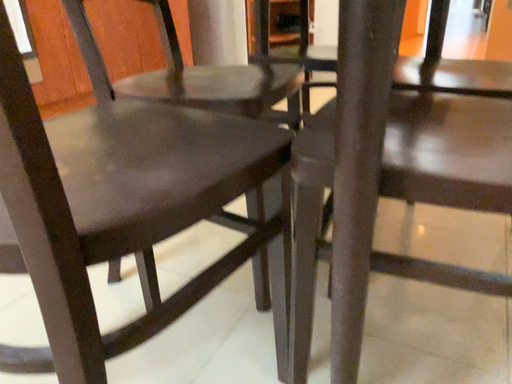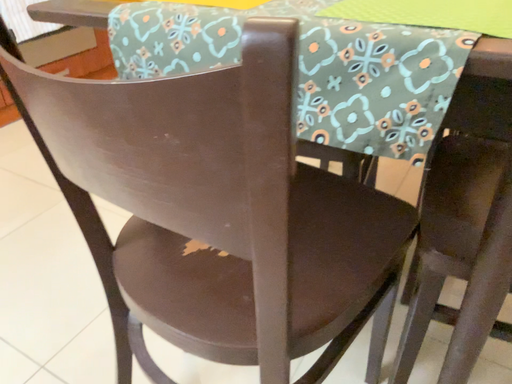
Question: Which way did the camera rotate in the video?

Choices:
 (A) rotated upward
 (B) rotated downward

Answer: (B)